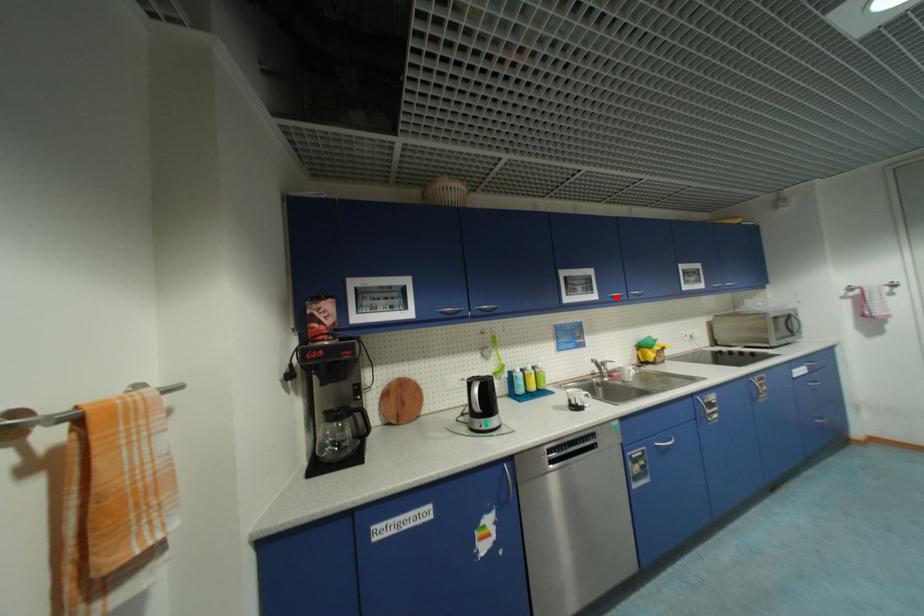
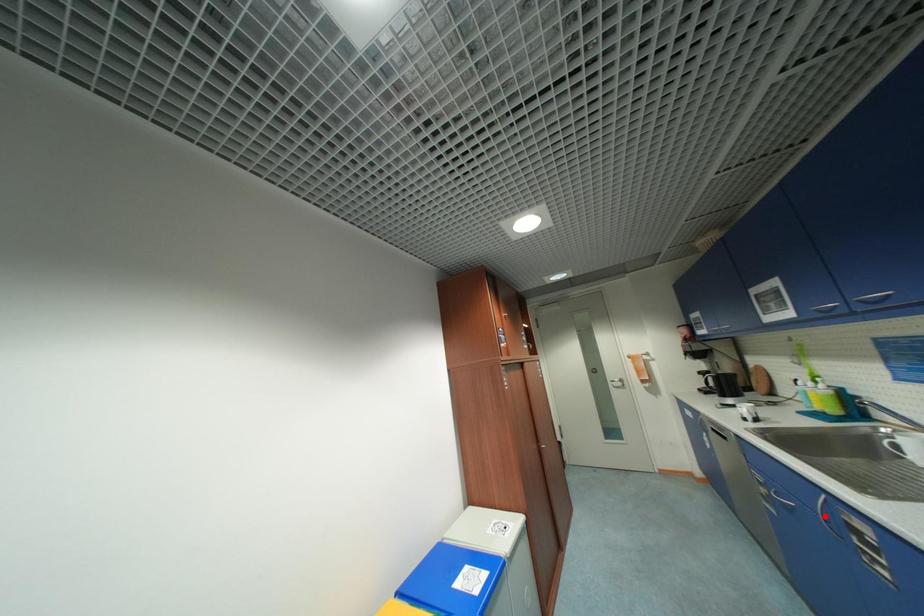
I am providing you with two images of the same scene from different viewpoints. A red point is marked on the first image and another point is marked on the second image. Is the marked point in image1 the same physical position as the marked point in image2?

No